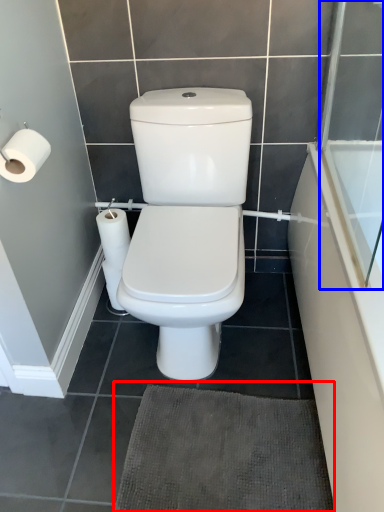
Question: Which object is further to the camera taking this photo, bath mat (highlighted by a red box) or screen door (highlighted by a blue box)?

Choices:
 (A) bath mat
 (B) screen door

Answer: (A)